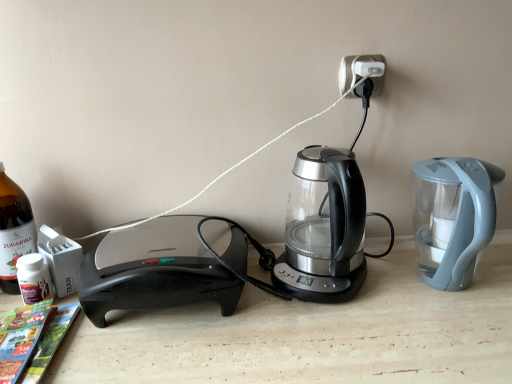
Question: Is white plastic electric outlet at upper center positioned with its back to bottle glass at left?

Choices:
 (A) no
 (B) yes

Answer: (A)

Question: Is white plastic electric outlet at upper center not close to bottle glass at left?

Choices:
 (A) yes
 (B) no

Answer: (B)

Question: Does white plastic electric outlet at upper center turn towards bottle glass at left?

Choices:
 (A) no
 (B) yes

Answer: (A)

Question: Does white plastic electric outlet at upper center appear on the left side of bottle glass at left?

Choices:
 (A) no
 (B) yes

Answer: (A)

Question: From the image's perspective, is white plastic electric outlet at upper center under bottle glass at left?

Choices:
 (A) no
 (B) yes

Answer: (A)

Question: Is white plastic electric outlet at upper center inside or outside of bottle glass at left?

Choices:
 (A) outside
 (B) inside

Answer: (A)

Question: Is point (x=352, y=76) positioned closer to the camera than point (x=33, y=226)?

Choices:
 (A) closer
 (B) farther

Answer: (A)

Question: From a real-world perspective, is white plastic electric outlet at upper center physically located above or below bottle glass at left?

Choices:
 (A) below
 (B) above

Answer: (B)

Question: In terms of width, does white plastic electric outlet at upper center look wider or thinner when compared to bottle glass at left?

Choices:
 (A) thin
 (B) wide

Answer: (A)

Question: Is transparent glass kettle at center wider or thinner than white plastic electric outlet at upper center?

Choices:
 (A) wide
 (B) thin

Answer: (A)

Question: From a real-world perspective, is transparent glass kettle at center positioned above or below white plastic electric outlet at upper center?

Choices:
 (A) above
 (B) below

Answer: (B)

Question: Looking at the image, does transparent glass kettle at center seem bigger or smaller compared to white plastic electric outlet at upper center?

Choices:
 (A) big
 (B) small

Answer: (A)

Question: From the image's perspective, is transparent glass kettle at center located above or below white plastic electric outlet at upper center?

Choices:
 (A) below
 (B) above

Answer: (A)

Question: From a real-world perspective, is white plastic electric outlet at upper center physically located above or below transparent glass kettle at center?

Choices:
 (A) above
 (B) below

Answer: (A)

Question: From the image's perspective, relative to transparent glass kettle at center, is white plastic electric outlet at upper center above or below?

Choices:
 (A) below
 (B) above

Answer: (B)